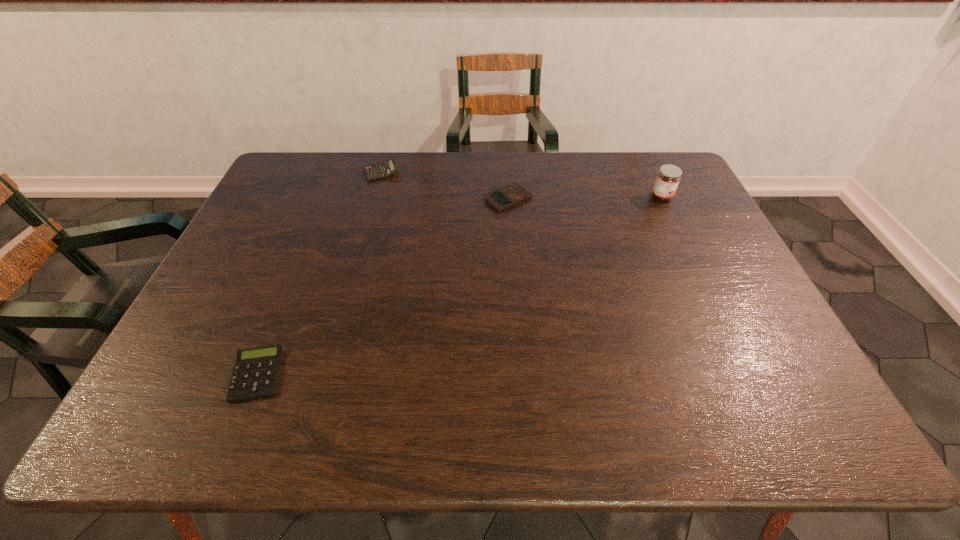
Identify the location of jam. (668, 177).

This screenshot has width=960, height=540. I want to click on the tallest object, so click(668, 177).

I want to click on the tallest calculator, so click(384, 170).

At what (x,y) coordinates should I click in order to perform the action: click on the second calculator from right to left. Please return your answer as a coordinate pair (x, y). This screenshot has width=960, height=540. Looking at the image, I should click on (384, 170).

This screenshot has width=960, height=540. Identify the location of the rightmost calculator. (506, 197).

You are a GUI agent. You are given a task and a screenshot of the screen. Output one action in this format:
    pyautogui.click(x=<x>, y=<y>)
    Task: Click on the second shortest object
    
    Given the screenshot: What is the action you would take?
    pyautogui.click(x=506, y=197)

Where is `the shortest calculator`? This screenshot has width=960, height=540. the shortest calculator is located at coordinates (256, 372).

This screenshot has height=540, width=960. In order to click on the leftmost calculator in this screenshot , I will do `click(256, 372)`.

You are a GUI agent. You are given a task and a screenshot of the screen. Output one action in this format:
    pyautogui.click(x=<x>, y=<y>)
    Task: Click on the vacant point located on the left of the jam
    
    Given the screenshot: What is the action you would take?
    [596, 197]

Where is `vacant region located on the front of the tallest calculator`? vacant region located on the front of the tallest calculator is located at coordinates (362, 240).